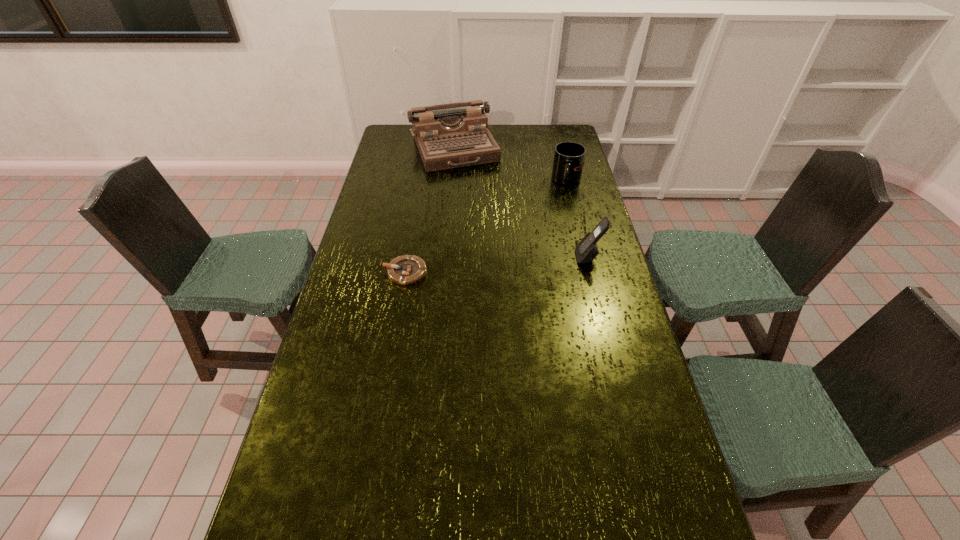
Find the location of a particular element. vacant point that satisfies the following two spatial constraints: 1. on the front side of the cellular telephone; 2. on the front-facing side of the third tallest object is located at coordinates (586, 257).